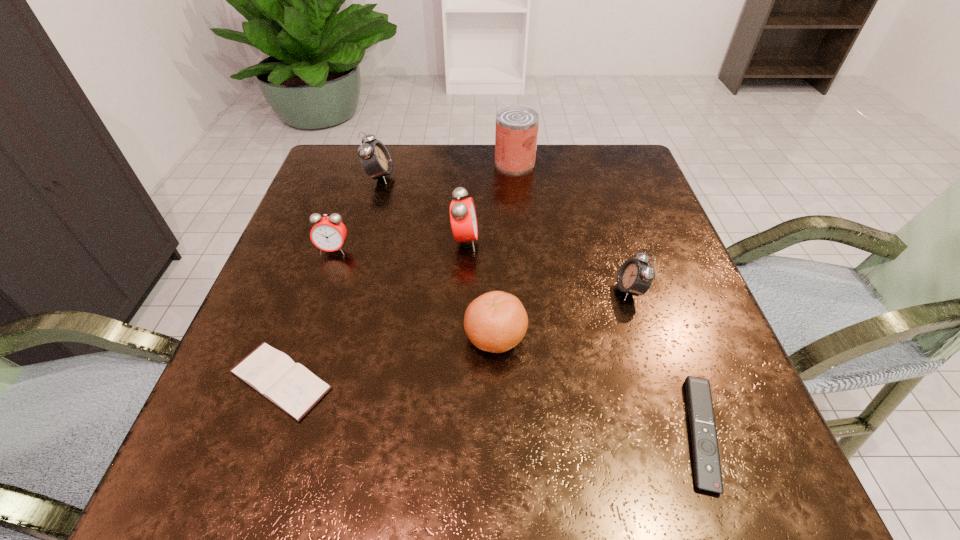
At what (x,y) coordinates should I click in order to perform the action: click on free location at the left edge. Please return your answer as a coordinate pair (x, y). This screenshot has height=540, width=960. Looking at the image, I should click on (299, 287).

Image resolution: width=960 pixels, height=540 pixels. What are the coordinates of `vacant area at the right edge` in the screenshot? It's located at [x=625, y=203].

Locate an element on the screen. This screenshot has height=540, width=960. vacant region at the far left corner of the desktop is located at coordinates (341, 150).

In order to click on vacant space at the near left corner of the desktop in this screenshot , I will do `click(223, 464)`.

Locate an element on the screen. This screenshot has height=540, width=960. free space at the far right corner of the desktop is located at coordinates (645, 188).

Find the location of a particular element. The height and width of the screenshot is (540, 960). free spot between the nearer white alarm clock and the can is located at coordinates (x=572, y=226).

Locate an element on the screen. Image resolution: width=960 pixels, height=540 pixels. free spot between the left red alarm clock and the fifth farthest object is located at coordinates (482, 270).

You are a GUI agent. You are given a task and a screenshot of the screen. Output one action in this format:
    pyautogui.click(x=<x>, y=<y>)
    Task: Click on the vacant space that's between the rightmost alarm clock and the left red alarm clock
    This screenshot has height=540, width=960.
    Given the screenshot: What is the action you would take?
    pyautogui.click(x=482, y=270)

This screenshot has width=960, height=540. Find the location of `free space between the left red alarm clock and the diary`. free space between the left red alarm clock and the diary is located at coordinates (307, 315).

Find the location of `free space between the right red alarm clock and the farthest alarm clock`. free space between the right red alarm clock and the farthest alarm clock is located at coordinates (422, 209).